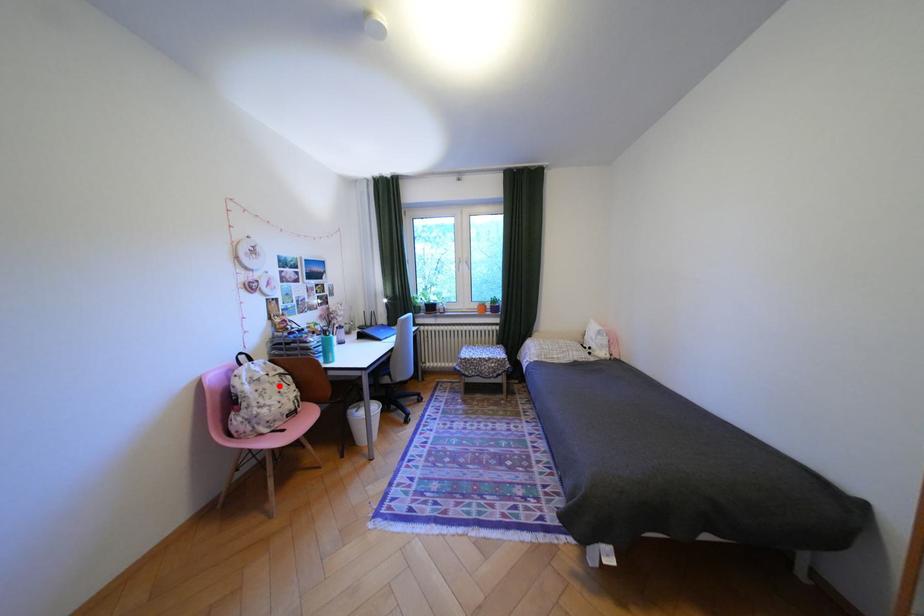
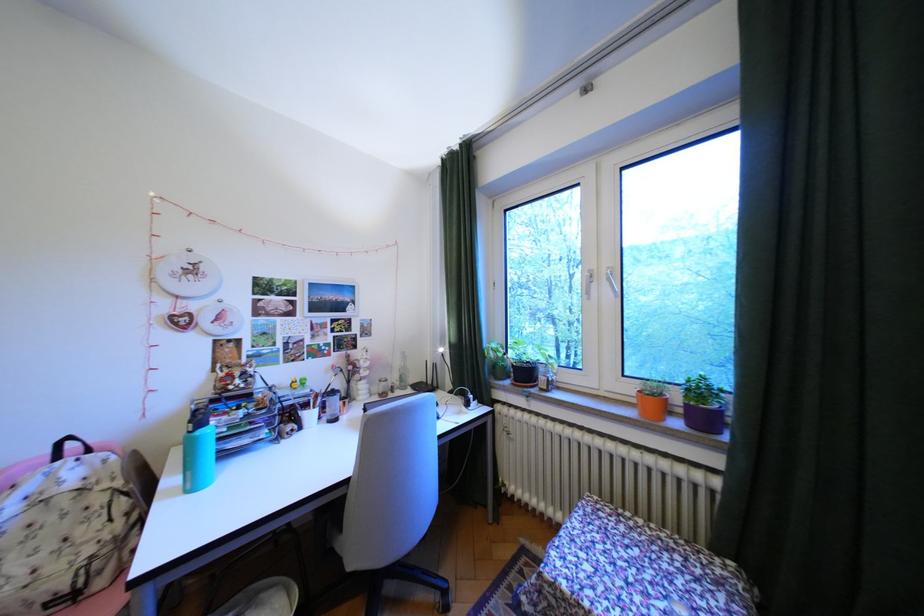
In the second image, find the point that corresponds to the highlighted location in the first image.

(65, 519)